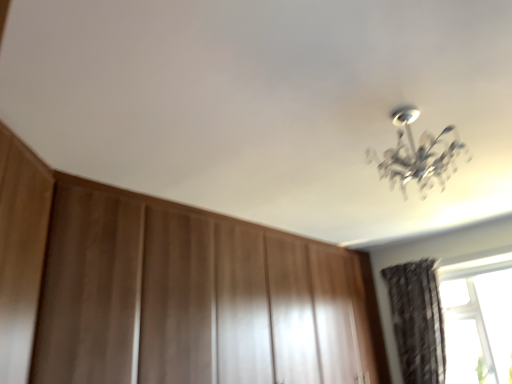
Question: From the image's perspective, is dark textured curtain at lower right positioned above or below wooden dresser at center?

Choices:
 (A) above
 (B) below

Answer: (B)

Question: Is dark textured curtain at lower right in front of or behind wooden dresser at center in the image?

Choices:
 (A) behind
 (B) front

Answer: (A)

Question: Is point (410, 299) closer or farther from the camera than point (343, 375)?

Choices:
 (A) farther
 (B) closer

Answer: (A)

Question: From a real-world perspective, is wooden dresser at center physically located above or below dark textured curtain at lower right?

Choices:
 (A) above
 (B) below

Answer: (A)

Question: Relative to dark textured curtain at lower right, is wooden dresser at center in front or behind?

Choices:
 (A) behind
 (B) front

Answer: (B)

Question: Looking at the image, does wooden dresser at center seem bigger or smaller compared to dark textured curtain at lower right?

Choices:
 (A) small
 (B) big

Answer: (B)

Question: Considering the positions of wooden dresser at center and dark textured curtain at lower right in the image, is wooden dresser at center wider or thinner than dark textured curtain at lower right?

Choices:
 (A) wide
 (B) thin

Answer: (A)